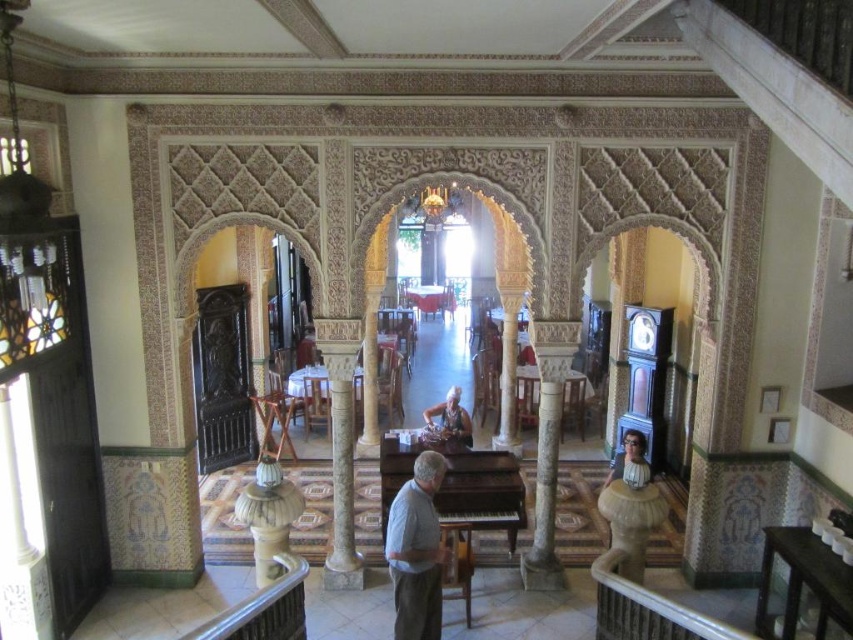
Who is shorter, matte brown hair at center or matte gray shirt at lower right?

Standing shorter between the two is matte gray shirt at lower right.

Between point (451, 442) and point (614, 458), which one is positioned behind?

Positioned behind is point (614, 458).

You are a GUI agent. You are given a task and a screenshot of the screen. Output one action in this format:
    pyautogui.click(x=<x>, y=<y>)
    Task: Click on the matte brown hair at center
    This screenshot has height=640, width=853.
    Given the screenshot: What is the action you would take?
    pyautogui.click(x=450, y=419)

Is gray cotton shirt at center shorter than matte brown hair at center?

Incorrect, gray cotton shirt at center's height does not fall short of matte brown hair at center's.

Which is above, gray cotton shirt at center or matte brown hair at center?

matte brown hair at center is higher up.

Who is more distant from viewer, (x=392, y=579) or (x=456, y=387)?

Positioned behind is point (x=456, y=387).

This screenshot has width=853, height=640. In order to click on gray cotton shirt at center in this screenshot , I will do `click(416, 550)`.

Does gray cotton shirt at center appear under white marble pillar at center?

Indeed, gray cotton shirt at center is positioned under white marble pillar at center.

Between gray cotton shirt at center and white marble pillar at center, which one has less height?

Standing shorter between the two is gray cotton shirt at center.

Is point (440, 547) closer to camera compared to point (550, 481)?

Yes, it is in front of point (550, 481).

Locate an element on the screen. gray cotton shirt at center is located at coordinates click(416, 550).